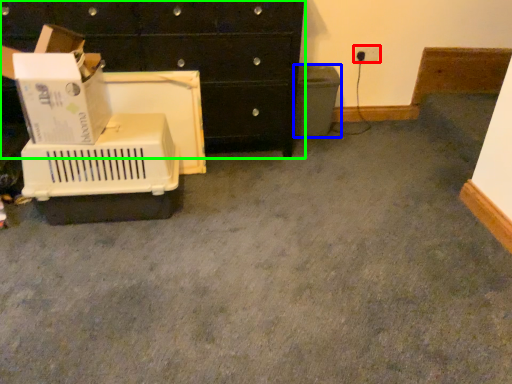
Question: Considering the real-world distances, which object is closest to electric outlet (highlighted by a red box)? recycling bin (highlighted by a blue box) or chest of drawers (highlighted by a green box).

Choices:
 (A) recycling bin
 (B) chest of drawers

Answer: (A)